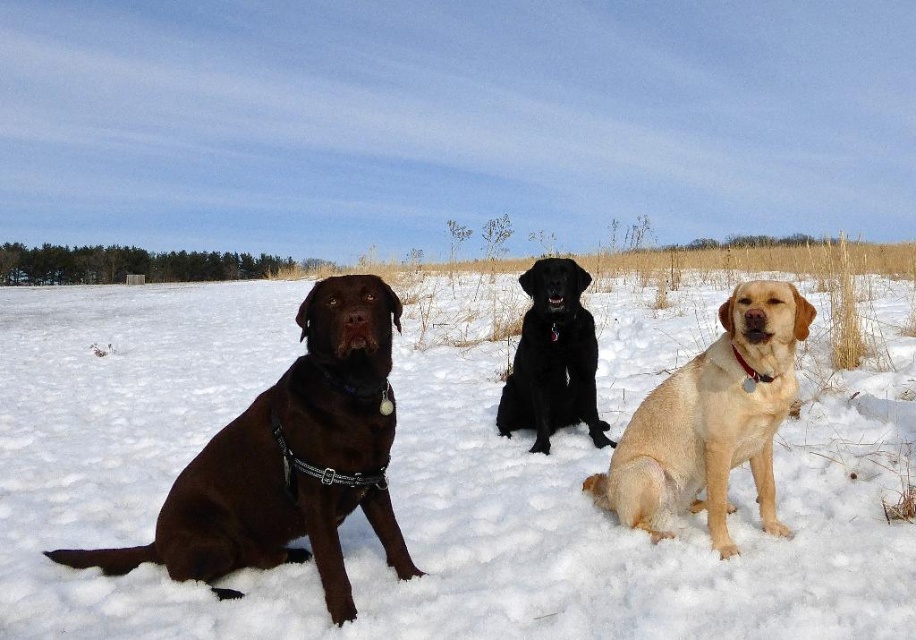
You are a photographer wanting to capture a group photo of the golden fur dog at center and the black glossy dog at center. Since you want the dogs to appear proportionally sized in the photo, which dog should you position closer to the camera?

The golden fur dog at center is bigger than the black glossy dog at center. To make them appear proportionally sized in the photo, position the smaller black glossy dog at center closer to the camera while keeping the larger golden fur dog at center farther back.

You are a photographer wanting to capture a group photo of the golden fur dog at center and the black glossy dog at center. Your camera has a maximum focus range of 4 feet. Can you take a photo of both dogs at the same time without moving either of them?

The golden fur dog at center and the black glossy dog at center are 4.39 feet apart. Since the camera can only focus within 4 feet, the distance between them exceeds the camera range. Therefore, you cannot capture both dogs in focus simultaneously without moving them.

You are a photographer trying to capture the black glossy dog at center in the winter scene. However, the white fluffy snow at center is making it hard to see the dog. Can you determine if the dog is visible beneath the snow?

The white fluffy snow at center is positioned over black glossy dog at center, so the dog may be partially or fully obscured by the snow, making it difficult to see clearly.